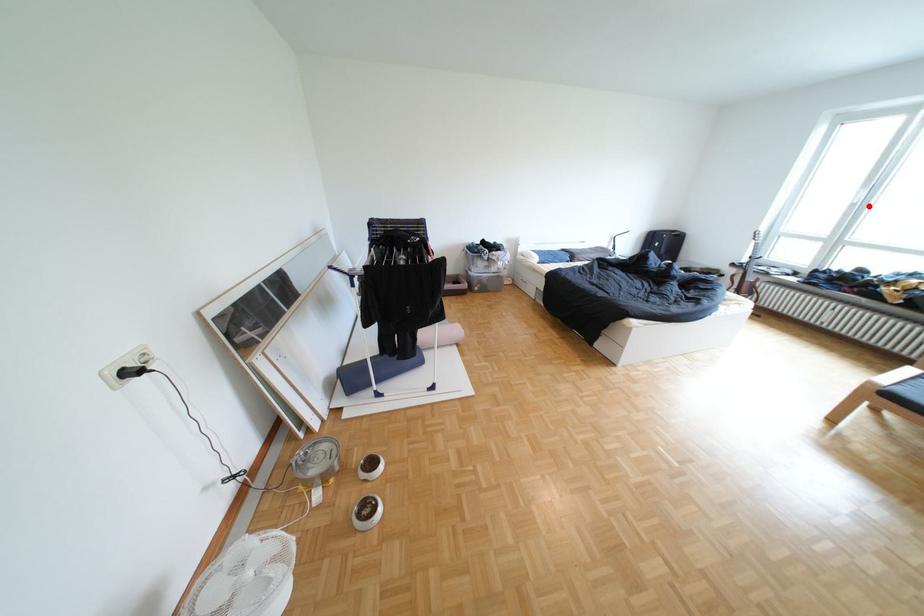
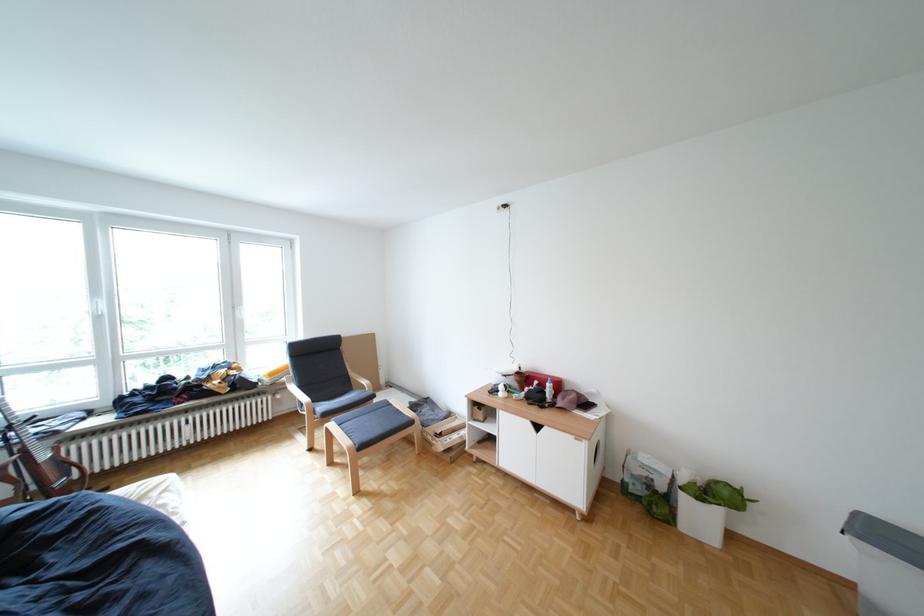
The point at the highlighted location is marked in the first image. Where is the corresponding point in the second image?

(114, 318)